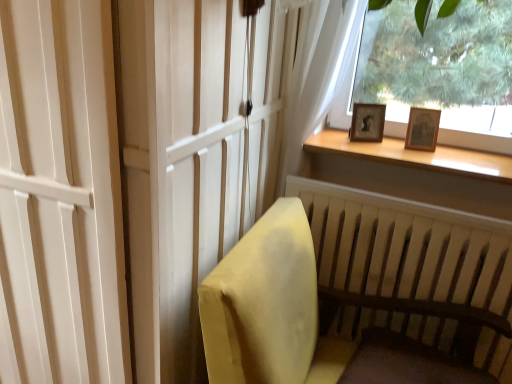
What is the approximate height of wooden at upper right?

wooden at upper right is 4.25 centimeters tall.

Locate an element on the screen. This screenshot has width=512, height=384. wooden photo frame at upper right is located at coordinates (367, 122).

Describe the element at coordinates (317, 74) in the screenshot. I see `white sheer curtain at upper right` at that location.

What is the approximate width of dark wood footrest at lower right?

It is 18.03 inches.

I want to click on velvet yellow chair at lower right, so click(356, 309).

Identify the location of wooden at upper right. The image size is (512, 384). (416, 156).

Consider the image. Is dark wood footrest at lower right looking in the opposite direction of white sheer curtain at upper right?

dark wood footrest at lower right is not turned away from white sheer curtain at upper right.

Considering the sizes of objects dark wood footrest at lower right and white sheer curtain at upper right in the image provided, who is thinner, dark wood footrest at lower right or white sheer curtain at upper right?

Thinner between the two is white sheer curtain at upper right.

Is point (376, 360) positioned before point (289, 89)?

Yes, point (376, 360) is closer to viewer.

From the image's perspective, is dark wood footrest at lower right located above or below white sheer curtain at upper right?

dark wood footrest at lower right is situated lower than white sheer curtain at upper right in the image.

Does wooden frame at upper right have a greater height compared to velvet yellow chair at lower right?

No.

This screenshot has width=512, height=384. I want to click on furniture below the wooden frame at upper right (from the image's perspective), so click(x=356, y=309).

Based on the photo, considering the sizes of objects wooden frame at upper right and velvet yellow chair at lower right in the image provided, who is smaller, wooden frame at upper right or velvet yellow chair at lower right?

wooden frame at upper right is smaller.

Considering their positions, is wooden frame at upper right located in front of or behind velvet yellow chair at lower right?

Clearly, wooden frame at upper right is behind velvet yellow chair at lower right.

Is wooden frame at upper right behind white matte screen door at left?

Yes, wooden frame at upper right is further from the camera.

Locate an element on the screen. window that appears behind the white matte screen door at left is located at coordinates (440, 71).

From a real-world perspective, who is located lower, wooden frame at upper right or white matte screen door at left?

white matte screen door at left.

The height and width of the screenshot is (384, 512). In order to click on footrest on the left of the wooden frame at upper right in this screenshot , I will do `click(406, 363)`.

Considering the points (507, 113) and (382, 332), which point is in front, point (507, 113) or point (382, 332)?

The point (382, 332) is closer.

In the scene shown: From a real-world perspective, is wooden frame at upper right below dark wood footrest at lower right?

Actually, wooden frame at upper right is physically above dark wood footrest at lower right in the real world.

Considering the relative sizes of wooden frame at upper right and dark wood footrest at lower right in the image provided, is wooden frame at upper right taller than dark wood footrest at lower right?

Yes.

Where is `window above the white sheer curtain at upper right (from the image's perspective)`? The image size is (512, 384). window above the white sheer curtain at upper right (from the image's perspective) is located at coordinates (440, 71).

Is wooden frame at upper right located outside white sheer curtain at upper right?

Yes, wooden frame at upper right is outside of white sheer curtain at upper right.

From the image's perspective, is wooden frame at upper right located above or below white sheer curtain at upper right?

wooden frame at upper right is situated higher than white sheer curtain at upper right in the image.

Considering the sizes of objects wooden frame at upper right and white sheer curtain at upper right in the image provided, who is bigger, wooden frame at upper right or white sheer curtain at upper right?

Bigger between the two is wooden frame at upper right.

Considering the relative sizes of wooden at upper right and velvet yellow chair at lower right in the image provided, is wooden at upper right shorter than velvet yellow chair at lower right?

Yes, wooden at upper right is shorter than velvet yellow chair at lower right.

From the image's perspective, which object appears higher, wooden at upper right or velvet yellow chair at lower right?

From the image's view, wooden at upper right is above.

Based on their positions, is wooden at upper right located to the left or right of velvet yellow chair at lower right?

Based on their positions, wooden at upper right is located to the right of velvet yellow chair at lower right.

Between velvet yellow chair at lower right and wooden at upper right, which one has more height?

With more height is velvet yellow chair at lower right.

From the picture: From the image's perspective, between velvet yellow chair at lower right and wooden at upper right, which one is located above?

From the image's view, wooden at upper right is above.

From the picture: From a real-world perspective, who is located higher, velvet yellow chair at lower right or wooden at upper right?

In real-world perspective, wooden at upper right is above.

Locate an element on the screen. window sill on the right of the velvet yellow chair at lower right is located at coordinates (416, 156).

Locate an element on the screen. curtain above the dark wood footrest at lower right (from a real-world perspective) is located at coordinates (317, 74).

You are a GUI agent. You are given a task and a screenshot of the screen. Output one action in this format:
    pyautogui.click(x=<x>, y=<y>)
    Task: Click on the furniture on the left of wooden frame at upper right
    
    Given the screenshot: What is the action you would take?
    pyautogui.click(x=356, y=309)

From the image, which object appears to be farther from wooden at upper right, dark wood footrest at lower right or velvet yellow chair at lower right?

dark wood footrest at lower right.

When comparing their distances from velvet yellow chair at lower right, does wooden photo frame at upper right or white sheer curtain at upper right seem closer?

Based on the image, white sheer curtain at upper right appears to be nearer to velvet yellow chair at lower right.

When comparing their distances from wooden photo frame at upper right, does velvet yellow chair at lower right or white matte screen door at left seem further?

white matte screen door at left lies further to wooden photo frame at upper right than the other object.

Consider the image. Based on their spatial positions, is velvet yellow chair at lower right or dark wood footrest at lower right further from white matte screen door at left?

dark wood footrest at lower right lies further to white matte screen door at left than the other object.

When comparing their distances from wooden photo frame at upper right, does dark wood footrest at lower right or white matte screen door at left seem further?

Based on the image, white matte screen door at left appears to be further to wooden photo frame at upper right.

Consider the image. Which object lies further to the anchor point wooden frame at upper right, white sheer curtain at upper right or velvet yellow chair at lower right?

Among the two, velvet yellow chair at lower right is located further to wooden frame at upper right.

Estimate the real-world distances between objects in this image. Which object is further from wooden frame at upper right, dark wood footrest at lower right or wooden at upper right?

dark wood footrest at lower right is further to wooden frame at upper right.

Considering their positions, is white sheer curtain at upper right positioned closer to velvet yellow chair at lower right than wooden photo frame at upper right?

The object closer to velvet yellow chair at lower right is white sheer curtain at upper right.

Image resolution: width=512 pixels, height=384 pixels. What are the coordinates of `picture frame between wooden frame at upper right and wooden at upper right from top to bottom` in the screenshot? It's located at (367, 122).

I want to click on furniture between wooden photo frame at upper right and dark wood footrest at lower right in the up-down direction, so click(x=356, y=309).

Locate an element on the screen. picture frame between white matte screen door at left and wooden at upper right in the horizontal direction is located at coordinates (367, 122).

Find the location of a particular element. The width and height of the screenshot is (512, 384). curtain between wooden frame at upper right and velvet yellow chair at lower right in the up-down direction is located at coordinates (317, 74).